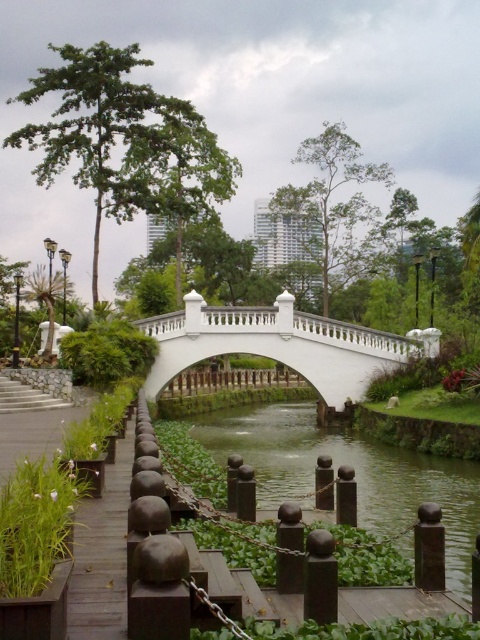
From the picture: You are a park visitor standing at the wooden planks at lower left and want to cross to the other side of the waterway. Can you see the top of the white marble bridge at center from your current position?

The white marble bridge at center is taller than the wooden planks at lower left, so yes, you can see the top of the white marble bridge at center from your current position.

You are a gardener who needs to place a new decorative stone statue that is 1 meter wide. You see the green mossy river at center and the wooden planks at lower left. Which object is more suitable to place the statue next to, considering their positions?

The wooden planks at lower left are positioned to the left of the green mossy river at center, so placing the statue next to the wooden planks at lower left would be more suitable as it has space to the right where the statue can be placed without obstructing the river area.